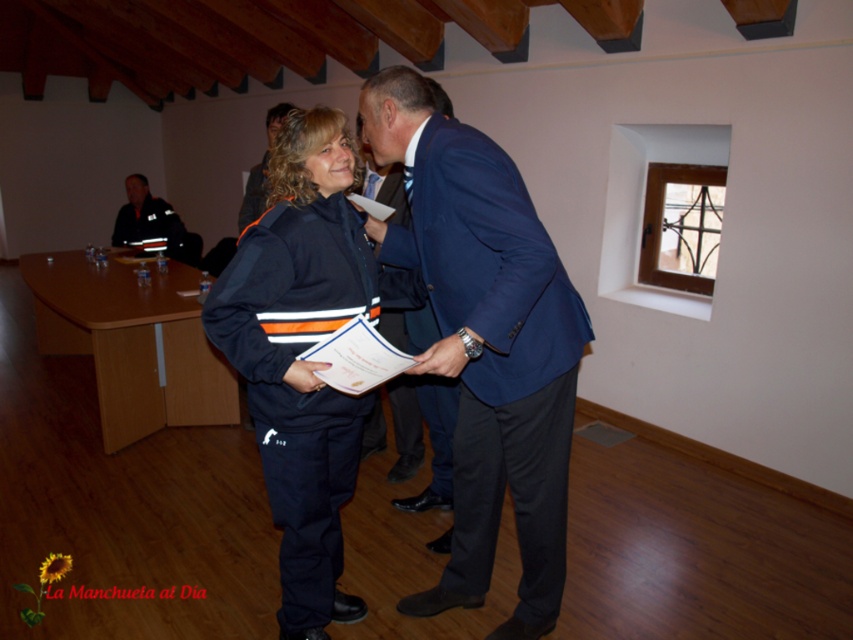
Question: Is blue fabric suit at center wider than navy blue uniform at center?

Choices:
 (A) yes
 (B) no

Answer: (A)

Question: Which of the following is the farthest from the observer?

Choices:
 (A) (421, 333)
 (B) (163, 232)
 (C) (552, 282)

Answer: (B)

Question: Can you confirm if blue fabric suit at center is positioned to the right of reflective black uniform at upper left?

Choices:
 (A) no
 (B) yes

Answer: (B)

Question: Which point is farther to the camera?

Choices:
 (A) matte blue jacket at center
 (B) navy blue jacket at center

Answer: (B)

Question: Estimate the real-world distances between objects in this image. Which object is farther from the navy blue uniform at center?

Choices:
 (A) blue fabric suit at center
 (B) blue suit at center
 (C) navy blue jacket at center

Answer: (C)

Question: Considering the relative positions of navy blue uniform at center and blue suit at center in the image provided, where is navy blue uniform at center located with respect to blue suit at center?

Choices:
 (A) above
 (B) below

Answer: (A)